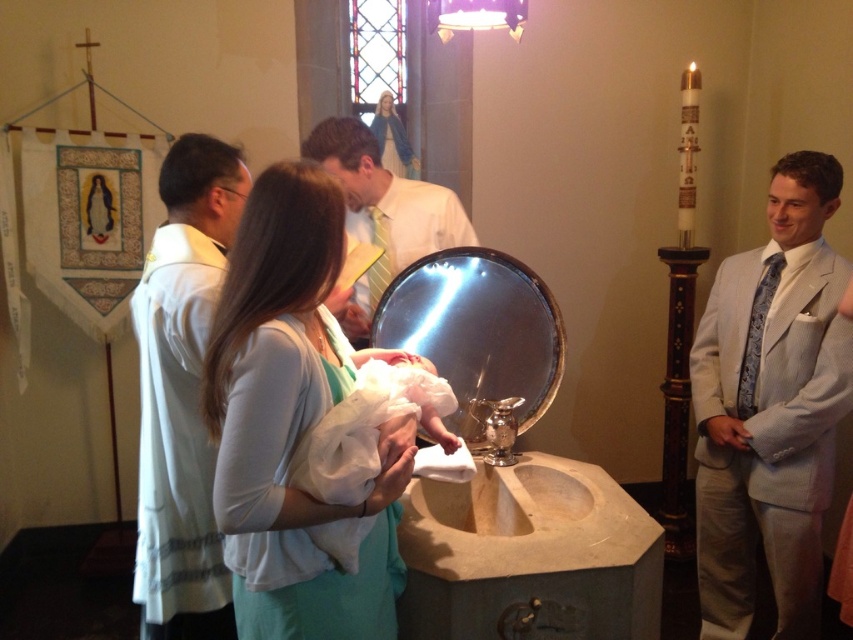
Who is shorter, light gray suit at right or white clothed baby at center?

Standing shorter between the two is white clothed baby at center.

Can you confirm if light gray suit at right is smaller than white clothed baby at center?

No, light gray suit at right is not smaller than white clothed baby at center.

At what (x,y) coordinates should I click in order to perform the action: click on light gray suit at right. Please return your answer as a coordinate pair (x, y). The width and height of the screenshot is (853, 640). Looking at the image, I should click on (770, 406).

Who is shorter, light gray suit at right or white matte vestment at left?

white matte vestment at left is shorter.

Does point (753, 464) come behind point (202, 333)?

Yes, point (753, 464) is farther from viewer.

What do you see at coordinates (770, 406) in the screenshot? I see `light gray suit at right` at bounding box center [770, 406].

At what (x,y) coordinates should I click in order to perform the action: click on light gray suit at right. Please return your answer as a coordinate pair (x, y). This screenshot has width=853, height=640. Looking at the image, I should click on click(x=770, y=406).

Between white fabric baby at center and white matte vestment at left, which one appears on the right side from the viewer's perspective?

white fabric baby at center

What do you see at coordinates (292, 420) in the screenshot? The image size is (853, 640). I see `white fabric baby at center` at bounding box center [292, 420].

Image resolution: width=853 pixels, height=640 pixels. What are the coordinates of `white fabric baby at center` in the screenshot? It's located at (292, 420).

Image resolution: width=853 pixels, height=640 pixels. I want to click on white fabric baby at center, so click(x=292, y=420).